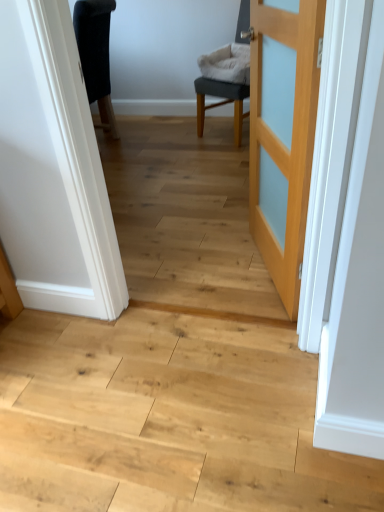
Question: Considering the positions of light wood door at center and gray fabric chair at center in the image, is light wood door at center taller or shorter than gray fabric chair at center?

Choices:
 (A) short
 (B) tall

Answer: (B)

Question: Is light wood door at center to the left or to the right of gray fabric chair at center in the image?

Choices:
 (A) left
 (B) right

Answer: (A)

Question: Which is nearer to the light wood door at center?

Choices:
 (A) gray fabric chair at center
 (B) natural wood floor at center

Answer: (B)

Question: Estimate the real-world distances between objects in this image. Which object is farther from the gray fabric chair at center?

Choices:
 (A) light wood door at center
 (B) natural wood floor at center

Answer: (B)